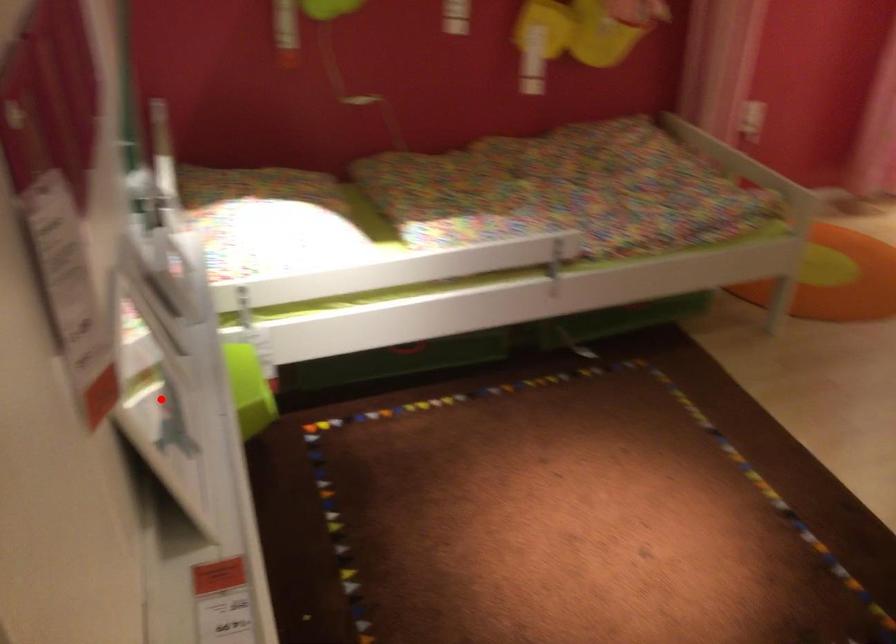
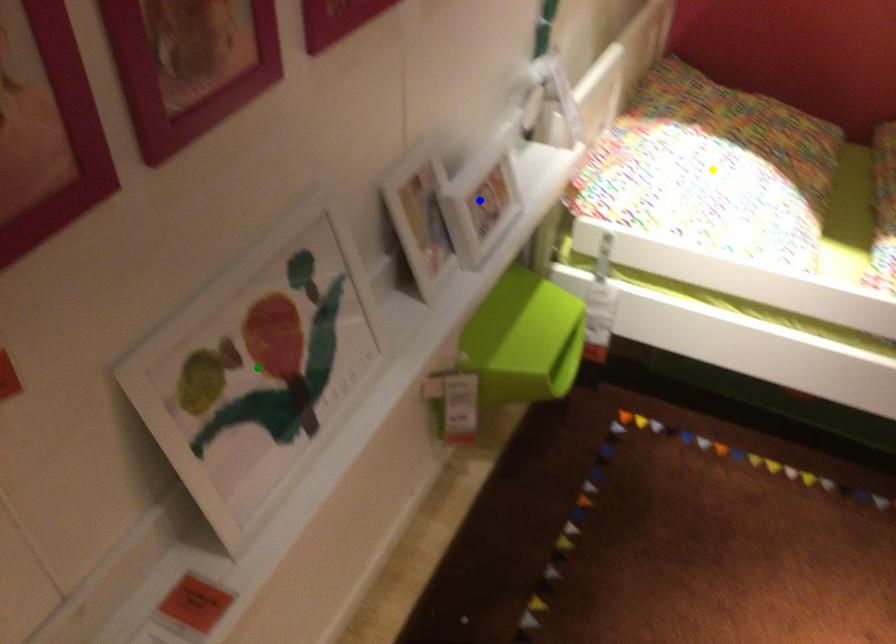
Question: I am providing you with two images of the same scene from different viewpoints. A red point is marked on the first image. You are given multiple points on the second image. In image 2, which mark is for the same physical point as the one in image 1?

Choices:
 (A) yellow point
 (B) green point
 (C) blue point

Answer: (B)